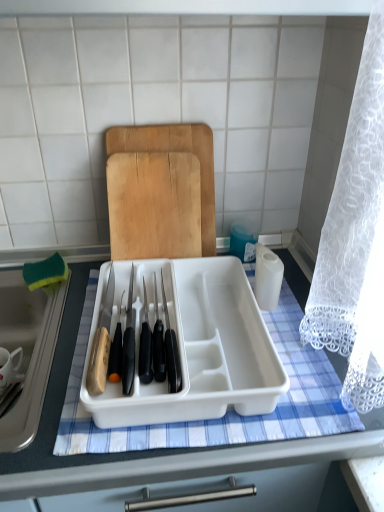
Question: Is white plastic tray at center positioned with its back to white plastic tray at center?

Choices:
 (A) no
 (B) yes

Answer: (A)

Question: From the image's perspective, is white plastic tray at center over white plastic tray at center?

Choices:
 (A) no
 (B) yes

Answer: (B)

Question: From a real-world perspective, is white plastic tray at center over white plastic tray at center?

Choices:
 (A) yes
 (B) no

Answer: (A)

Question: From the image's perspective, is white plastic tray at center located beneath white plastic tray at center?

Choices:
 (A) no
 (B) yes

Answer: (A)

Question: Considering the relative positions of white plastic tray at center and white plastic tray at center in the image provided, is white plastic tray at center to the left of white plastic tray at center from the viewer's perspective?

Choices:
 (A) yes
 (B) no

Answer: (B)

Question: Can you confirm if white plastic tray at center is shorter than white plastic tray at center?

Choices:
 (A) yes
 (B) no

Answer: (A)

Question: From a real-world perspective, is green sponge at left positioned under wooden cutting board at center based on gravity?

Choices:
 (A) yes
 (B) no

Answer: (A)

Question: Could you tell me if green sponge at left is turned towards wooden cutting board at center?

Choices:
 (A) yes
 (B) no

Answer: (B)

Question: Can you confirm if green sponge at left is taller than wooden cutting board at center?

Choices:
 (A) no
 (B) yes

Answer: (A)

Question: Can you confirm if green sponge at left is positioned to the left of wooden cutting board at center?

Choices:
 (A) no
 (B) yes

Answer: (B)

Question: Is the depth of green sponge at left greater than that of wooden cutting board at center?

Choices:
 (A) no
 (B) yes

Answer: (A)

Question: From the image's perspective, is green sponge at left under wooden cutting board at center?

Choices:
 (A) no
 (B) yes

Answer: (B)

Question: Is the position of white plastic tray at center more distant than that of green sponge at left?

Choices:
 (A) yes
 (B) no

Answer: (B)